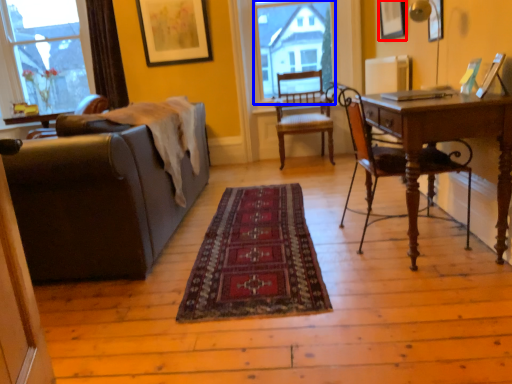
Question: Which object appears closest to the camera in this image, picture frame (highlighted by a red box) or bay window (highlighted by a blue box)?

Choices:
 (A) picture frame
 (B) bay window

Answer: (A)